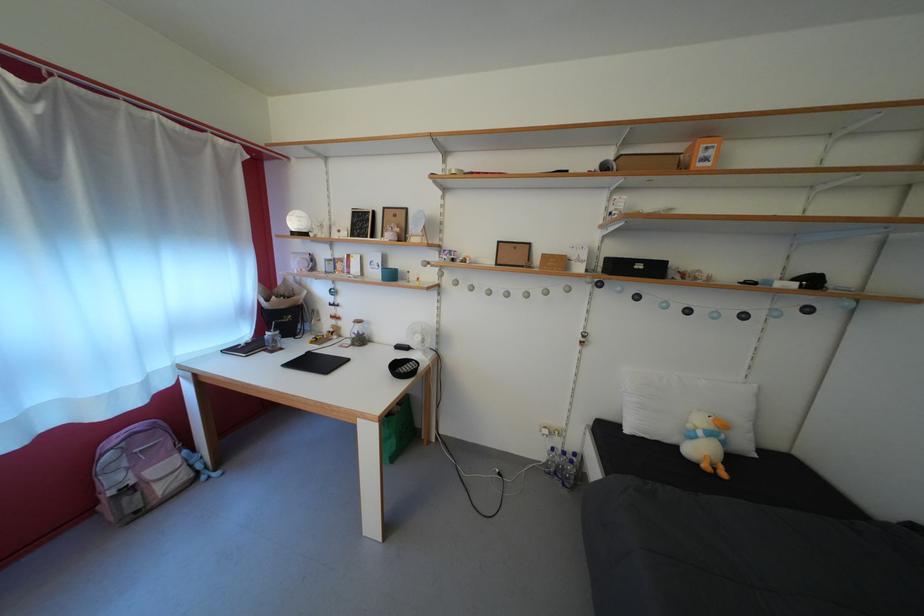
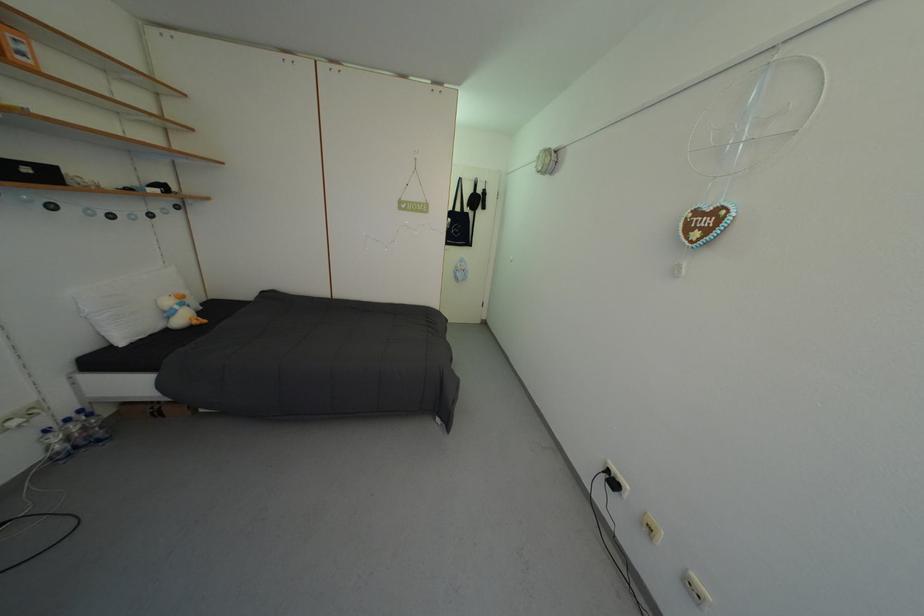
Find the pixel in the second image that matches (x=648, y=273) in the first image.

(35, 176)